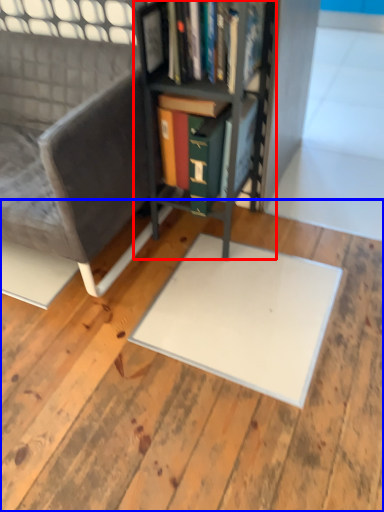
Question: Among these objects, which one is farthest to the camera, bookcase (highlighted by a red box) or plywood (highlighted by a blue box)?

Choices:
 (A) bookcase
 (B) plywood

Answer: (A)